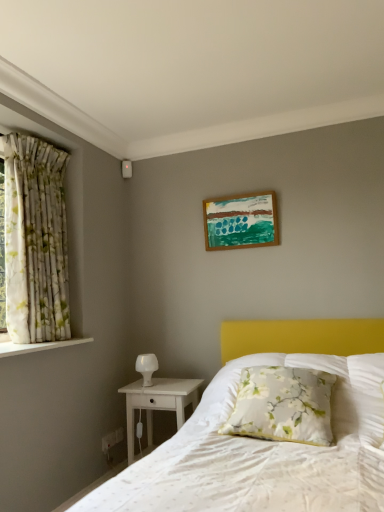
Question: From the image's perspective, would you say white wood nightstand at lower left is shown under floral fabric pillow at center?

Choices:
 (A) yes
 (B) no

Answer: (A)

Question: Is white wood nightstand at lower left turned away from floral fabric pillow at center?

Choices:
 (A) yes
 (B) no

Answer: (B)

Question: Can you confirm if white wood nightstand at lower left is positioned to the right of floral fabric pillow at center?

Choices:
 (A) no
 (B) yes

Answer: (A)

Question: Is white wood nightstand at lower left further to camera compared to floral fabric pillow at center?

Choices:
 (A) yes
 (B) no

Answer: (A)

Question: Is white wood nightstand at lower left located outside floral fabric pillow at center?

Choices:
 (A) no
 (B) yes

Answer: (B)

Question: From a real-world perspective, is white wood nightstand at lower left on top of floral fabric pillow at center?

Choices:
 (A) yes
 (B) no

Answer: (B)

Question: Does floral fabric pillow at center have a smaller size compared to wooden picture frame at upper center?

Choices:
 (A) no
 (B) yes

Answer: (A)

Question: Is floral fabric pillow at center located outside wooden picture frame at upper center?

Choices:
 (A) no
 (B) yes

Answer: (B)

Question: Is floral fabric pillow at center facing away from wooden picture frame at upper center?

Choices:
 (A) yes
 (B) no

Answer: (B)

Question: Does floral fabric pillow at center lie behind wooden picture frame at upper center?

Choices:
 (A) yes
 (B) no

Answer: (B)

Question: Is floral fabric pillow at center taller than wooden picture frame at upper center?

Choices:
 (A) yes
 (B) no

Answer: (B)

Question: Is the depth of floral fabric pillow at center less than that of wooden picture frame at upper center?

Choices:
 (A) no
 (B) yes

Answer: (B)

Question: Is wooden picture frame at upper center next to floral fabric curtain at left?

Choices:
 (A) yes
 (B) no

Answer: (B)